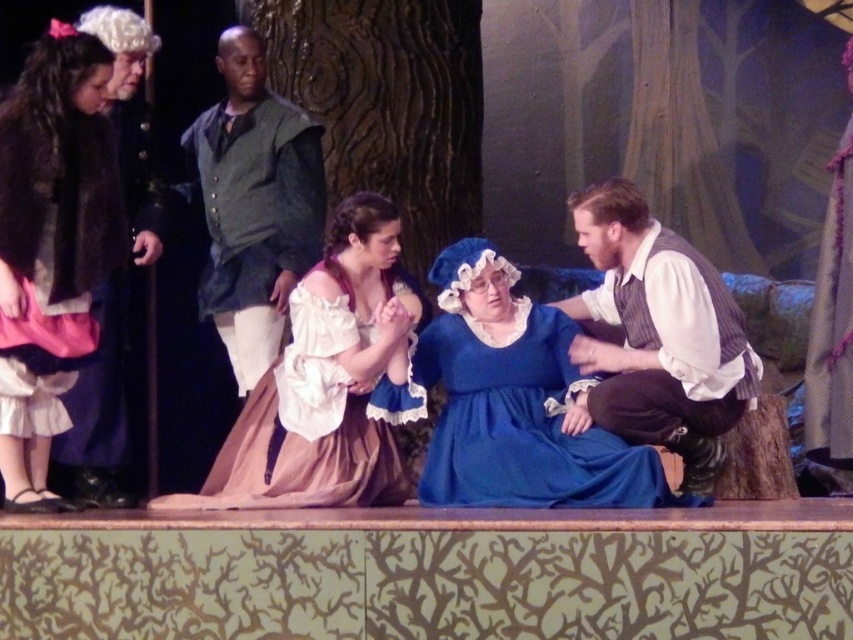
Question: Does velvet black coat at left have a smaller size compared to white lace dress at center?

Choices:
 (A) no
 (B) yes

Answer: (B)

Question: Does white lace dress at center have a smaller size compared to dark green fabric shirt at upper center?

Choices:
 (A) yes
 (B) no

Answer: (A)

Question: Among these objects, which one is nearest to the camera?

Choices:
 (A) velvet black coat at left
 (B) dark green fabric shirt at upper center

Answer: (A)

Question: Among these points, which one is nearest to the camera?

Choices:
 (A) (381, 433)
 (B) (444, 324)
 (C) (84, 259)

Answer: (C)

Question: Is blue satin dress at center above dark green fabric shirt at upper center?

Choices:
 (A) yes
 (B) no

Answer: (B)

Question: Among these objects, which one is farthest from the camera?

Choices:
 (A) white lace dress at center
 (B) striped vest at center
 (C) dark green fabric shirt at upper center
 (D) blue satin dress at center

Answer: (C)